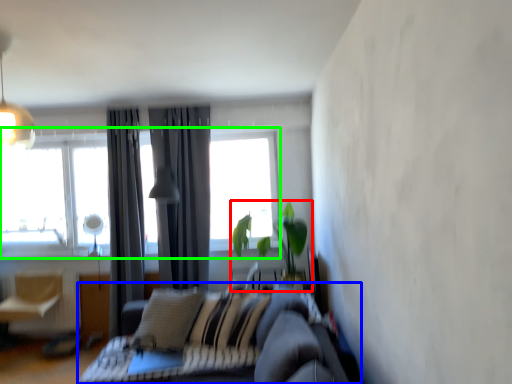
Question: Which object is the closest to the houseplant (highlighted by a red box)? Choose among these: studio couch (highlighted by a blue box) or window (highlighted by a green box).

Choices:
 (A) studio couch
 (B) window

Answer: (A)